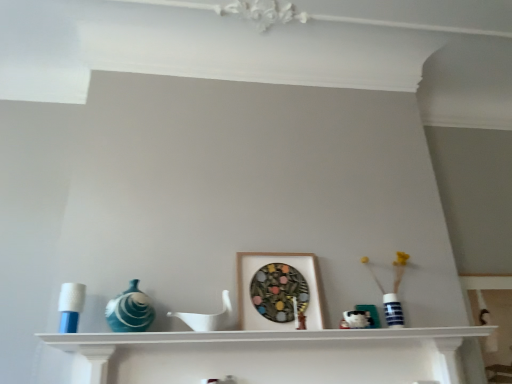
Question: Is white matte shelf at center smaller than wooden picture frame at center?

Choices:
 (A) yes
 (B) no

Answer: (B)

Question: Is white matte shelf at center bigger than wooden picture frame at center?

Choices:
 (A) yes
 (B) no

Answer: (A)

Question: Does white matte shelf at center have a greater width compared to wooden picture frame at center?

Choices:
 (A) yes
 (B) no

Answer: (A)

Question: From the image's perspective, is white matte shelf at center under wooden picture frame at center?

Choices:
 (A) no
 (B) yes

Answer: (B)

Question: Is white matte shelf at center not near wooden picture frame at center?

Choices:
 (A) no
 (B) yes

Answer: (A)

Question: Is blue striped vase at right spatially inside white matte shelf at center, or outside of it?

Choices:
 (A) inside
 (B) outside

Answer: (B)

Question: Does point (396, 271) appear closer or farther from the camera than point (309, 334)?

Choices:
 (A) closer
 (B) farther

Answer: (B)

Question: Based on their sizes in the image, would you say blue striped vase at right is bigger or smaller than white matte shelf at center?

Choices:
 (A) small
 (B) big

Answer: (A)

Question: Relative to white matte shelf at center, is blue striped vase at right in front or behind?

Choices:
 (A) behind
 (B) front

Answer: (A)

Question: Is point (64, 292) closer or farther from the camera than point (350, 322)?

Choices:
 (A) farther
 (B) closer

Answer: (B)

Question: In terms of width, does blue plastic candle holder at left look wider or thinner when compared to white glossy ceramic mug at center?

Choices:
 (A) wide
 (B) thin

Answer: (B)

Question: Considering their positions, is blue plastic candle holder at left located in front of or behind white glossy ceramic mug at center?

Choices:
 (A) behind
 (B) front

Answer: (B)

Question: From the image's perspective, is blue plastic candle holder at left above or below white glossy ceramic mug at center?

Choices:
 (A) below
 (B) above

Answer: (B)

Question: Visually, is white matte shelf at center positioned to the left or to the right of matte blue glass vase at left?

Choices:
 (A) left
 (B) right

Answer: (B)

Question: From the image's perspective, is white matte shelf at center positioned above or below matte blue glass vase at left?

Choices:
 (A) above
 (B) below

Answer: (B)